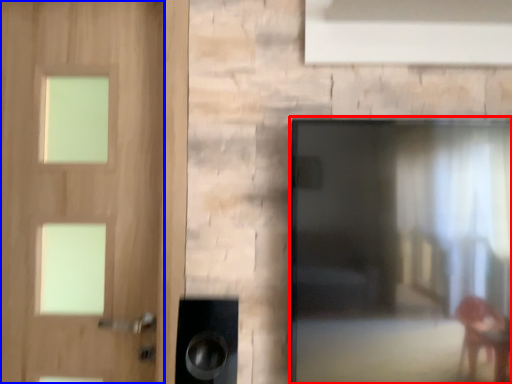
Question: Which object appears closest to the camera in this image, screen door (highlighted by a red box) or door (highlighted by a blue box)?

Choices:
 (A) screen door
 (B) door

Answer: (A)